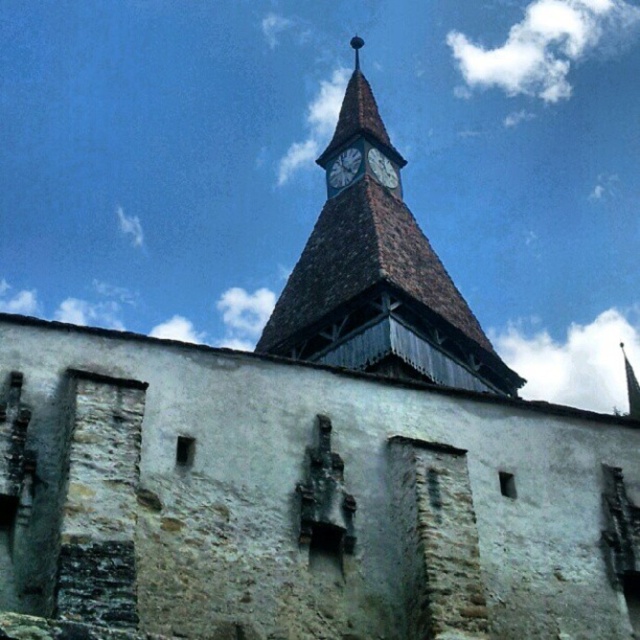
Which is in front, point (353, 260) or point (388, 163)?

Point (353, 260)

Does brown wooden clock tower at upper center have a greater width compared to white stone clock at upper center?

Yes, brown wooden clock tower at upper center is wider than white stone clock at upper center.

Who is more distant from viewer, (444, 284) or (381, 179)?

The point (381, 179) is more distant.

Identify the location of brown wooden clock tower at upper center. The height and width of the screenshot is (640, 640). (378, 280).

Who is taller, dark gray stone clock at upper center or white stone clock at upper center?

Standing taller between the two is white stone clock at upper center.

Does dark gray stone clock at upper center have a smaller size compared to white stone clock at upper center?

Yes, dark gray stone clock at upper center is smaller than white stone clock at upper center.

Is point (336, 157) closer to camera compared to point (381, 180)?

No, it is behind (381, 180).

Identify the location of dark gray stone clock at upper center. (344, 168).

Who is higher up, brown wooden clock tower at upper center or dark gray stone clock at upper center?

brown wooden clock tower at upper center is higher up.

The width and height of the screenshot is (640, 640). In order to click on brown wooden clock tower at upper center in this screenshot , I will do `click(378, 280)`.

You are a GUI agent. You are given a task and a screenshot of the screen. Output one action in this format:
    pyautogui.click(x=<x>, y=<y>)
    Task: Click on the brown wooden clock tower at upper center
    This screenshot has height=640, width=640.
    Given the screenshot: What is the action you would take?
    pyautogui.click(x=378, y=280)